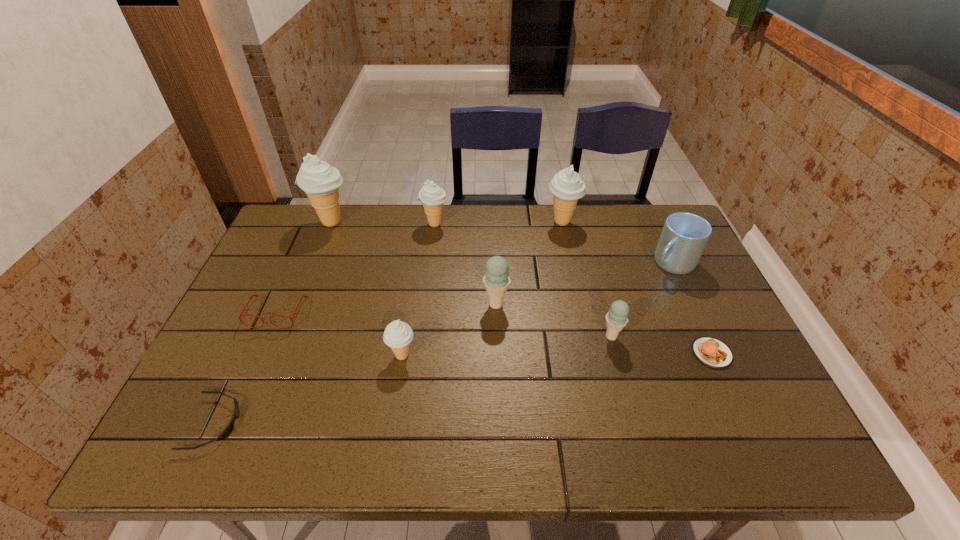
Image resolution: width=960 pixels, height=540 pixels. Find the location of `the nearest beige icecream`. the nearest beige icecream is located at coordinates (398, 335).

Where is `spectacles`? The height and width of the screenshot is (540, 960). spectacles is located at coordinates (240, 315).

Locate an element on the screen. The height and width of the screenshot is (540, 960). red spectacles is located at coordinates (240, 315).

I want to click on patty, so click(x=713, y=353).

Identify the location of the nearest object. (228, 430).

The width and height of the screenshot is (960, 540). What are the coordinates of `the shortest object` in the screenshot? It's located at coord(228,430).

Where is `vacant area situated 0.050m on the front of the biggest beige icecream`? The image size is (960, 540). vacant area situated 0.050m on the front of the biggest beige icecream is located at coordinates (322, 245).

Find the location of a particular element. free space located 0.210m on the front of the second biggest beige icecream is located at coordinates (574, 277).

The height and width of the screenshot is (540, 960). What are the coordinates of `free space located 0.330m on the right of the second smallest beige icecream` in the screenshot? It's located at (546, 224).

Find the location of a particular element. This screenshot has width=960, height=540. vacant area situated on the left of the farther blue ice cream is located at coordinates (349, 304).